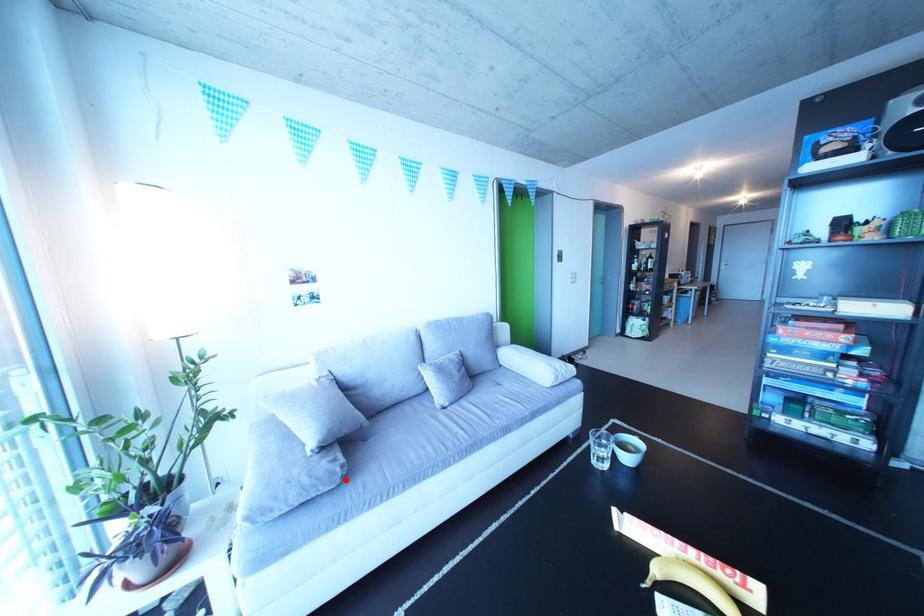
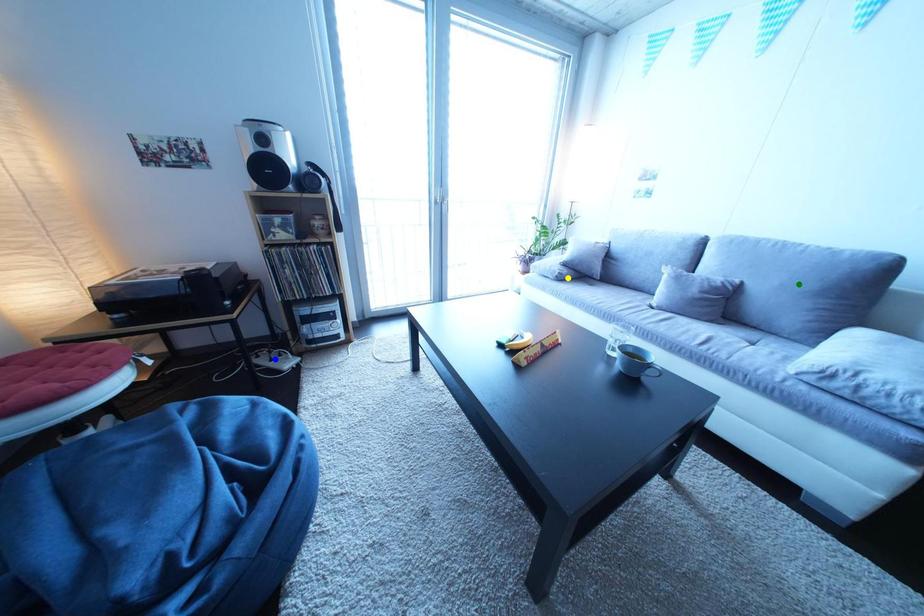
Question: I am providing you with two images of the same scene from different viewpoints. A red point is marked on the first image. You are given multiple points on the second image. Which mark in image 2 goes with the point in image 1?

Choices:
 (A) yellow point
 (B) green point
 (C) blue point

Answer: (A)